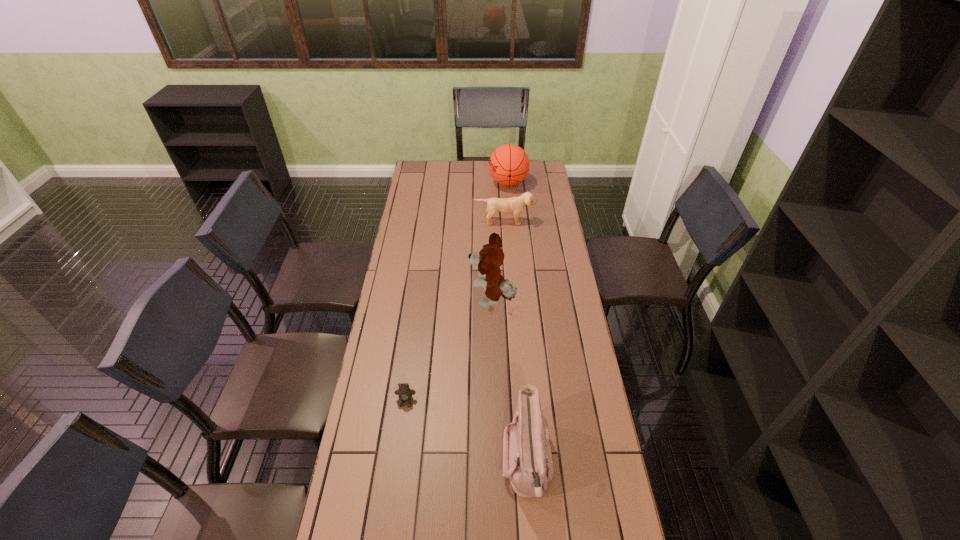
Locate an element on the screen. free spot between the teddy bear and the farther puppy is located at coordinates (455, 311).

At what (x,y) coordinates should I click in order to perform the action: click on free space between the shoulder bag and the shorter puppy. Please return your answer as a coordinate pair (x, y). This screenshot has width=960, height=540. Looking at the image, I should click on (516, 342).

You are a GUI agent. You are given a task and a screenshot of the screen. Output one action in this format:
    pyautogui.click(x=<x>, y=<y>)
    Task: Click on the free space between the leftmost object and the second tallest object
    The image size is (960, 540).
    Given the screenshot: What is the action you would take?
    pyautogui.click(x=457, y=292)

Identify the location of vacant space that's between the shorter puppy and the nearest object. (516, 342).

Select which object is the second closest to the shoulder bag. Please provide its 2D coordinates. Your answer should be formatted as a tuple, i.e. [(x, y)], where the tuple contains the x and y coordinates of a point satisfying the conditions above.

[(490, 257)]

Find the location of a particular element. The width and height of the screenshot is (960, 540). object that stands as the second closest to the second tallest object is located at coordinates (490, 257).

The image size is (960, 540). I want to click on vacant position in the image that satisfies the following two spatial constraints: 1. on the left side of the second farthest object; 2. on the face of the third nearest object, so click(510, 300).

Identify the location of vacant position in the image that satisfies the following two spatial constraints: 1. on the side with logo of the basketball; 2. on the left side of the second farthest object. Image resolution: width=960 pixels, height=540 pixels. (512, 221).

Where is `free spot that satisfies the following two spatial constraints: 1. on the face of the tallest object; 2. on the face of the shortest object`? The height and width of the screenshot is (540, 960). free spot that satisfies the following two spatial constraints: 1. on the face of the tallest object; 2. on the face of the shortest object is located at coordinates (495, 401).

Where is `vacant space that satisfies the following two spatial constraints: 1. on the side with logo of the farthest object; 2. on the left side of the farther puppy`? vacant space that satisfies the following two spatial constraints: 1. on the side with logo of the farthest object; 2. on the left side of the farther puppy is located at coordinates (512, 221).